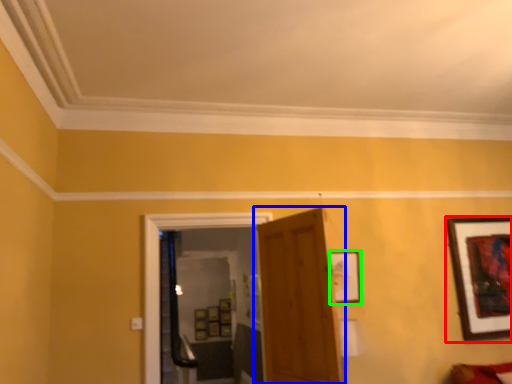
Question: Which object is the closest to the picture frame (highlighted by a red box)? Choose among these: door (highlighted by a blue box) or picture frame (highlighted by a green box).

Choices:
 (A) door
 (B) picture frame

Answer: (B)